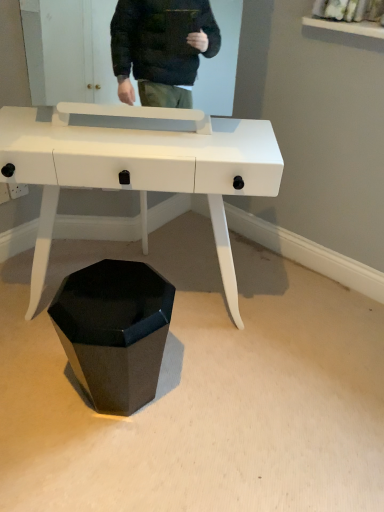
Identify the location of vacant area that is situated to the right of glossy black hexagonal at lower center. tap(198, 394).